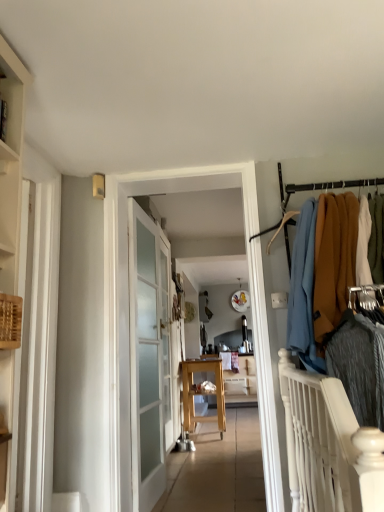
Question: From their relative heights in the image, would you say white frosted glass door at center is taller or shorter than wooden table at center?

Choices:
 (A) short
 (B) tall

Answer: (B)

Question: From a real-world perspective, is white frosted glass door at center positioned above or below wooden table at center?

Choices:
 (A) below
 (B) above

Answer: (B)

Question: Considering the real-world distances, which object is farthest from the wooden shelf at left?

Choices:
 (A) wooden table at center
 (B) white frosted glass door at center
 (C) matte glass door at center
 (D) wooden table at center
 (E) wooden table at center

Answer: (E)

Question: Estimate the real-world distances between objects in this image. Which object is farther from the white wooden balustrade at lower right?

Choices:
 (A) matte glass door at center
 (B) wooden shelf at left
 (C) clear glass door at center
 (D) wooden table at center
 (E) wooden table at center

Answer: (D)